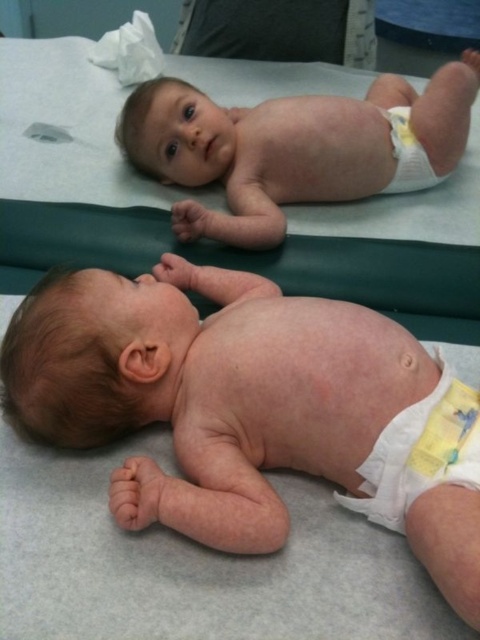
How distant is gray smooth hospital bed at center from smooth skin baby at upper center?

They are 8.11 inches apart.

Is gray smooth hospital bed at center thinner than smooth skin baby at upper center?

In fact, gray smooth hospital bed at center might be wider than smooth skin baby at upper center.

Which is in front, point (31, 54) or point (428, 83)?

Point (31, 54)

The image size is (480, 640). I want to click on gray smooth hospital bed at center, so click(x=208, y=204).

Which is behind, point (332, 417) or point (383, 448)?

The point (332, 417) is more distant.

Is pink smooth skin at center thinner than yellow/white cloth diaper at lower right?

Incorrect, pink smooth skin at center's width is not less than yellow/white cloth diaper at lower right's.

Is point (146, 275) positioned before point (392, 442)?

No, it is not.

At what (x,y) coordinates should I click in order to perform the action: click on pink smooth skin at center. Please return your answer as a coordinate pair (x, y). Looking at the image, I should click on (210, 388).

In the scene shown: Is smooth skin baby at upper center smaller than yellow fabric diaper at lower right?

No, smooth skin baby at upper center is not smaller than yellow fabric diaper at lower right.

Locate an element on the screen. smooth skin baby at upper center is located at coordinates (288, 147).

You are a GUI agent. You are given a task and a screenshot of the screen. Output one action in this format:
    pyautogui.click(x=<x>, y=<y>)
    Task: Click on the smooth skin baby at upper center
    This screenshot has height=640, width=480.
    Given the screenshot: What is the action you would take?
    pyautogui.click(x=288, y=147)